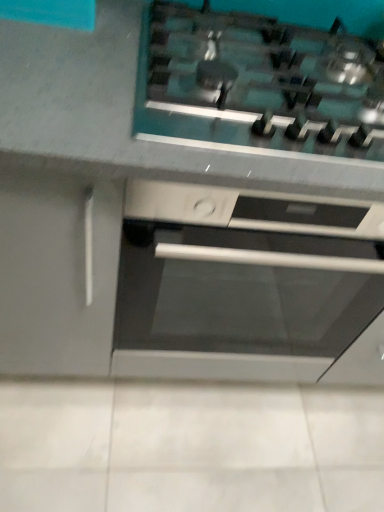
Question: Is satin steel gas stove at upper center further to the viewer compared to satin silver oven at center?

Choices:
 (A) no
 (B) yes

Answer: (A)

Question: From the image's perspective, is satin steel gas stove at upper center beneath satin silver oven at center?

Choices:
 (A) no
 (B) yes

Answer: (A)

Question: Is satin silver oven at center completely or partially inside satin steel gas stove at upper center?

Choices:
 (A) no
 (B) yes

Answer: (A)

Question: Can you confirm if satin steel gas stove at upper center is bigger than satin silver oven at center?

Choices:
 (A) no
 (B) yes

Answer: (A)

Question: From a real-world perspective, is satin steel gas stove at upper center on top of satin silver oven at center?

Choices:
 (A) no
 (B) yes

Answer: (B)

Question: Considering the relative sizes of satin steel gas stove at upper center and satin silver oven at center in the image provided, is satin steel gas stove at upper center shorter than satin silver oven at center?

Choices:
 (A) yes
 (B) no

Answer: (A)

Question: Is satin silver oven at center facing away from satin steel gas stove at upper center?

Choices:
 (A) yes
 (B) no

Answer: (B)

Question: Does satin silver oven at center come behind satin steel gas stove at upper center?

Choices:
 (A) no
 (B) yes

Answer: (B)

Question: Can you confirm if satin silver oven at center is taller than satin steel gas stove at upper center?

Choices:
 (A) no
 (B) yes

Answer: (B)

Question: Could you tell me if satin silver oven at center is turned towards satin steel gas stove at upper center?

Choices:
 (A) yes
 (B) no

Answer: (B)

Question: Is satin silver oven at center surrounding satin steel gas stove at upper center?

Choices:
 (A) no
 (B) yes

Answer: (A)

Question: Is satin silver oven at center with satin steel gas stove at upper center?

Choices:
 (A) yes
 (B) no

Answer: (B)

Question: From a real-world perspective, is satin steel gas stove at upper center above or below satin silver oven at center?

Choices:
 (A) below
 (B) above

Answer: (B)